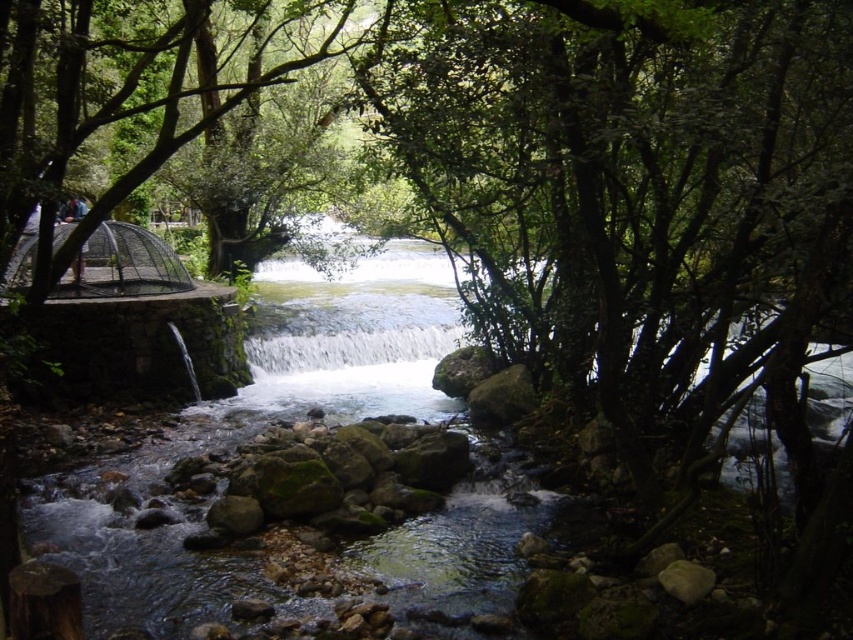
Question: Is green leafy tree at center smaller than white smooth waterfall at center?

Choices:
 (A) no
 (B) yes

Answer: (A)

Question: Which point appears farthest from the camera in this image?

Choices:
 (A) (270, 337)
 (B) (590, 321)

Answer: (A)

Question: Which of the following is the closest to the observer?

Choices:
 (A) (737, 68)
 (B) (427, 339)

Answer: (A)

Question: Does green leafy tree at center appear under white smooth waterfall at center?

Choices:
 (A) no
 (B) yes

Answer: (A)

Question: Can you confirm if green leafy tree at center is bigger than white smooth waterfall at center?

Choices:
 (A) no
 (B) yes

Answer: (B)